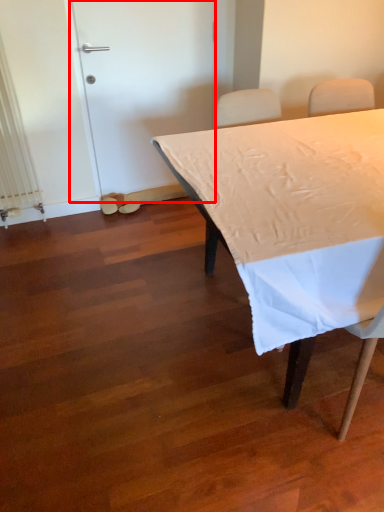
Question: From the image, what is the correct spatial relationship of door (annotated by the red box) in relation to table?

Choices:
 (A) right
 (B) left

Answer: (B)